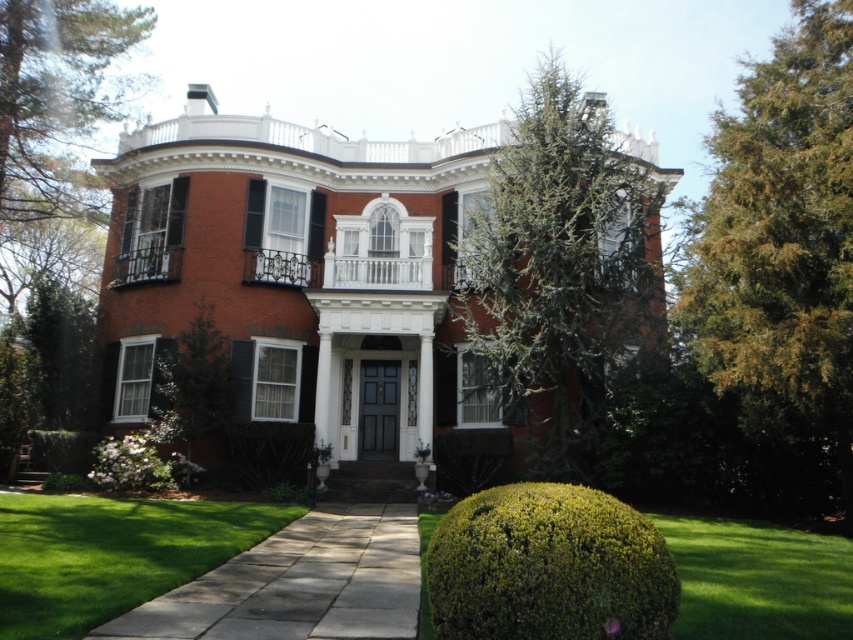
You are standing at the front door of the house and notice two points marked in the image. The first point is at coordinates point (322, 353) and the second is at point (810, 616). Which point is closer to you?

Point (322, 353) is behind point (810, 616), so the point closer to you is point (810, 616).

You are standing in front of the brick house at center and want to walk towards the green textured tree at right. Which direction should you move relative to the house?

The brick house at center is to the left of the green textured tree at right, so you should move to the right of the brick house at center to reach the green textured tree at right.

You are a landscape architect planning to plant a new tree that requires at least 5 meters of space between it and any structure. Given the brick house at center and the green textured tree at right, which one allows more space for planting the new tree?

The brick house at center has a larger width than the green textured tree at right, so planting the new tree near the brick house at center would provide more space as it requires at least 5 meters.